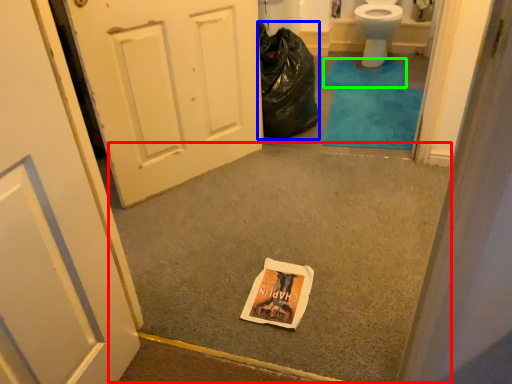
Question: Which is nearer to the concrete (highlighted by a red box)? garbage (highlighted by a blue box) or bath mat (highlighted by a green box).

Choices:
 (A) garbage
 (B) bath mat

Answer: (A)